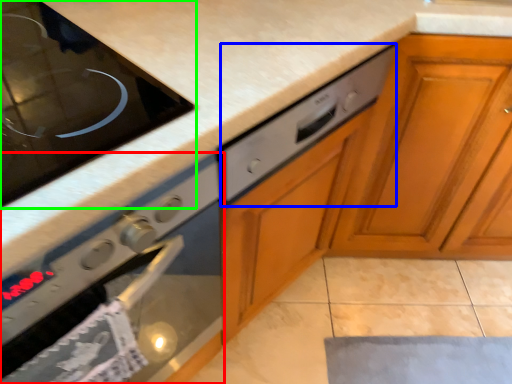
Question: Considering the real-world distances, which object is farthest from oven (highlighted by a red box)? drawer (highlighted by a blue box) or home appliance (highlighted by a green box)?

Choices:
 (A) drawer
 (B) home appliance

Answer: (B)